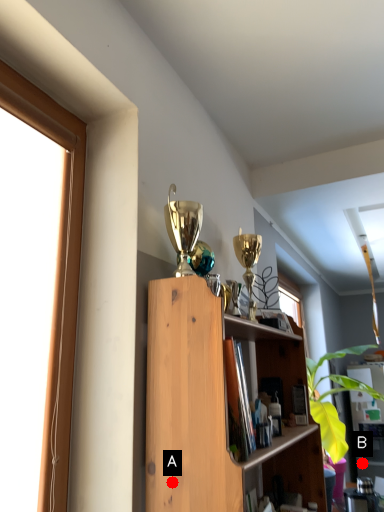
Question: Two points are circled on the image, labeled by A and B beside each circle. Among these points, which one is nearest to the camera?

Choices:
 (A) A is closer
 (B) B is closer

Answer: (A)